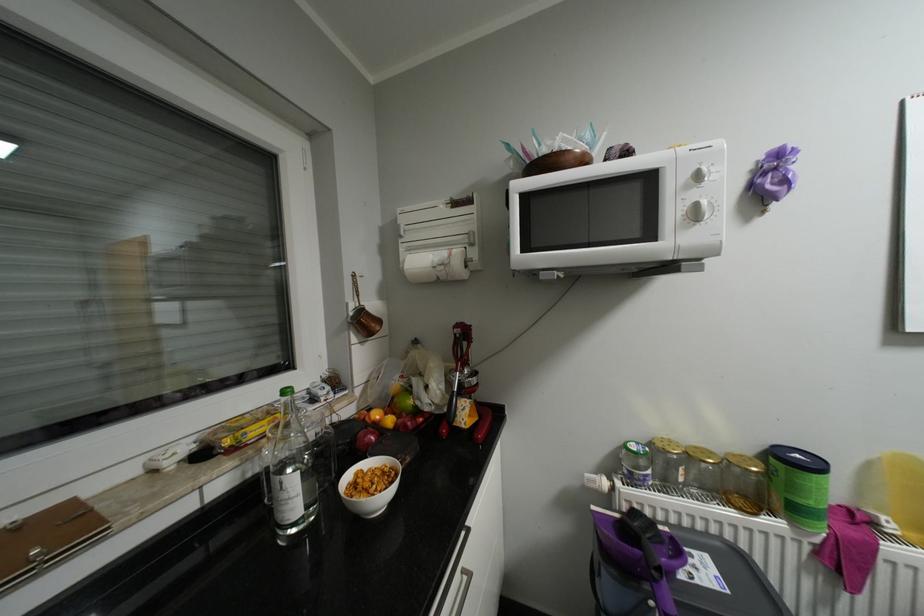
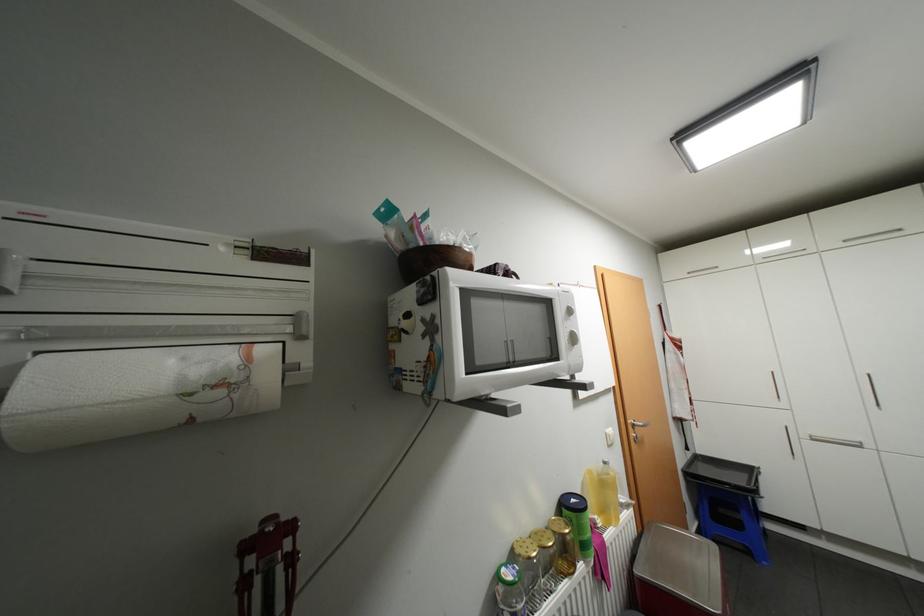
Find the pixel in the second image that matches the point at 806,455 in the first image.

(580, 499)